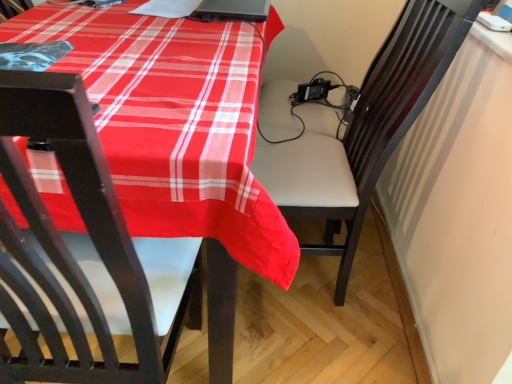
In order to click on vacant space in front of white leather chair at center in this screenshot , I will do `click(309, 348)`.